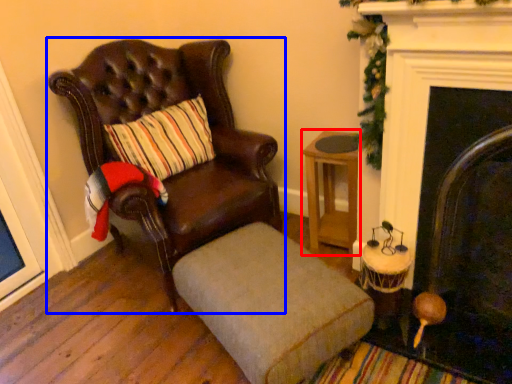
Question: Which object appears farthest to the camera in this image, table (highlighted by a red box) or chair (highlighted by a blue box)?

Choices:
 (A) table
 (B) chair

Answer: (A)